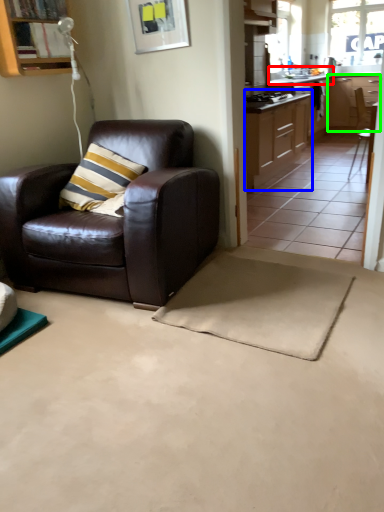
Question: Considering the real-world distances, which object is closest to sink (highlighted by a red box)? cabinetry (highlighted by a blue box) or cabinetry (highlighted by a green box).

Choices:
 (A) cabinetry
 (B) cabinetry

Answer: (B)